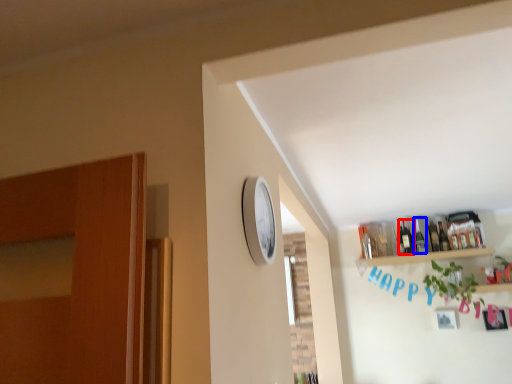
Question: Which point is closer to the camera, bottle (highlighted by a red box) or bottle (highlighted by a blue box)?

Choices:
 (A) bottle
 (B) bottle

Answer: (A)